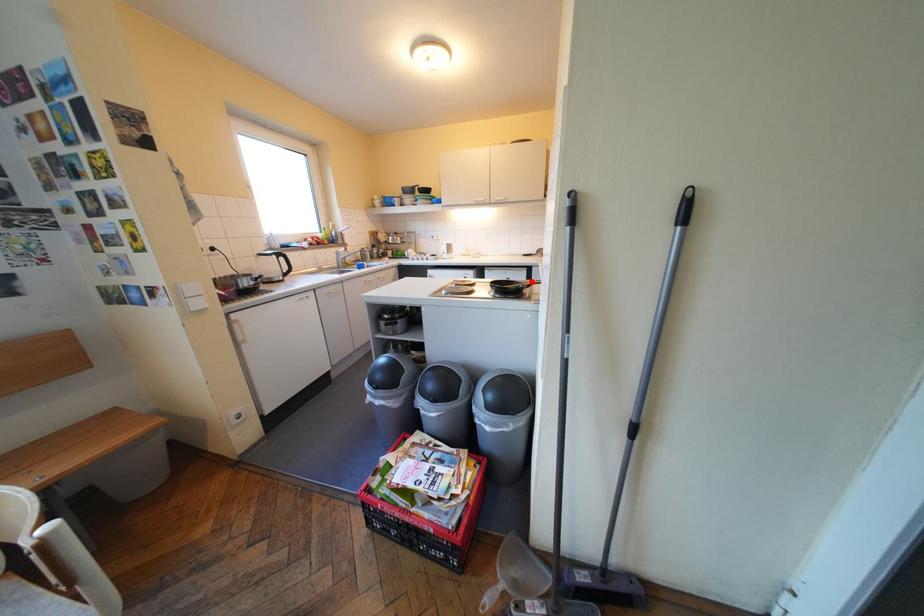
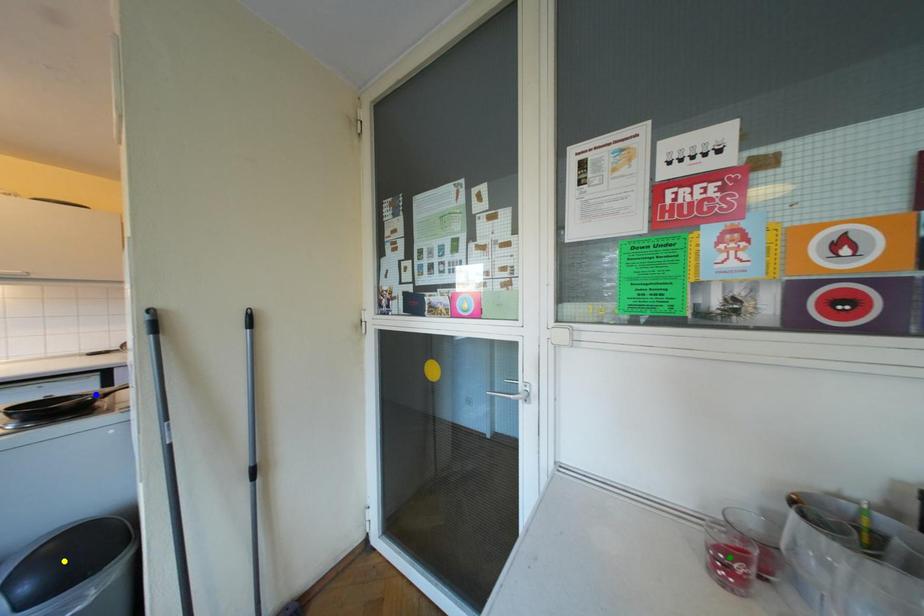
Question: I am providing you with two images of the same scene from different viewpoints. A red point is marked on the first image. You are given multiple points on the second image. Which point in image 2 is actually the same real-world point as the red point in image 1?

Choices:
 (A) yellow point
 (B) blue point
 (C) green point

Answer: (B)